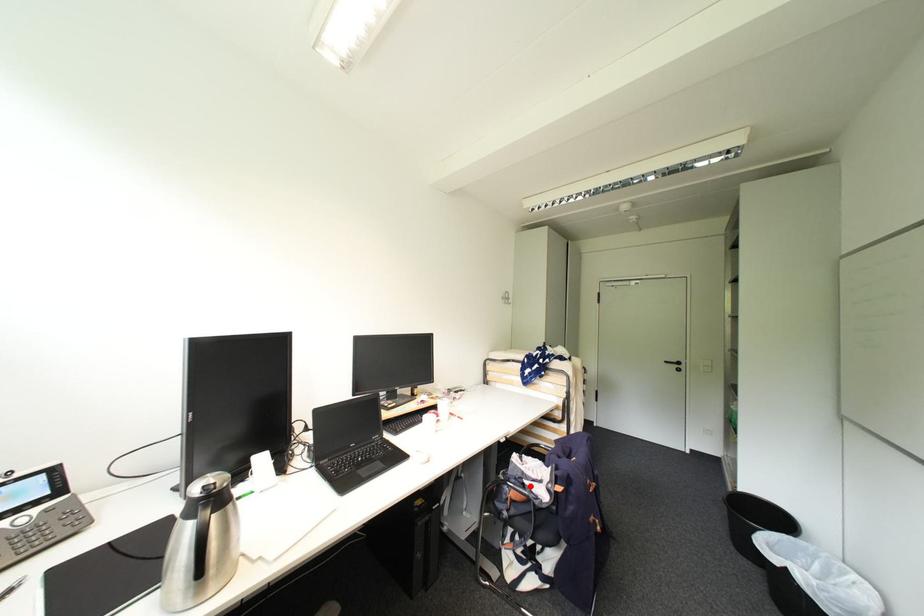
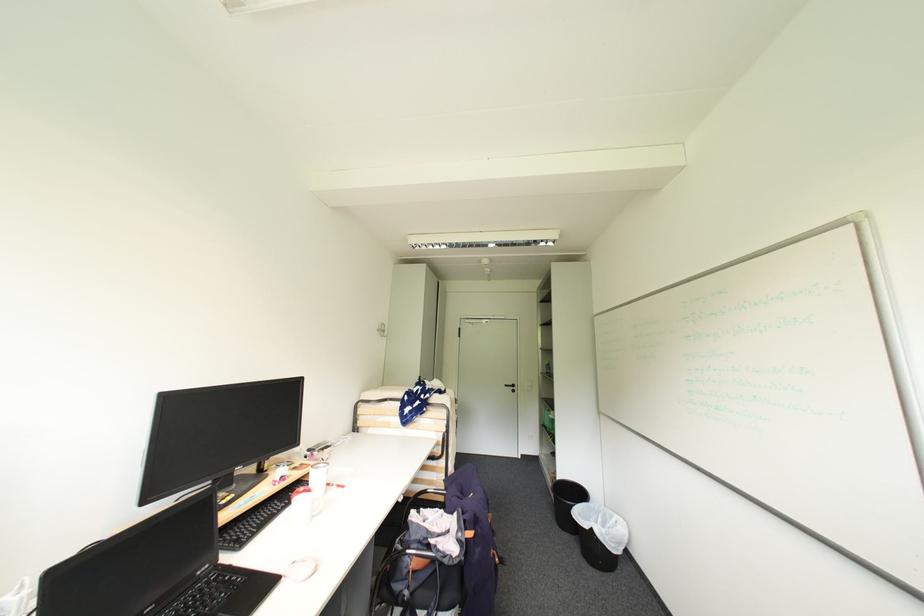
Question: I am providing you with two images of the same scene from different viewpoints. A red point is marked on the first image. Can you still see the location of the red point in image 2?

Choices:
 (A) Yes
 (B) No

Answer: (A)